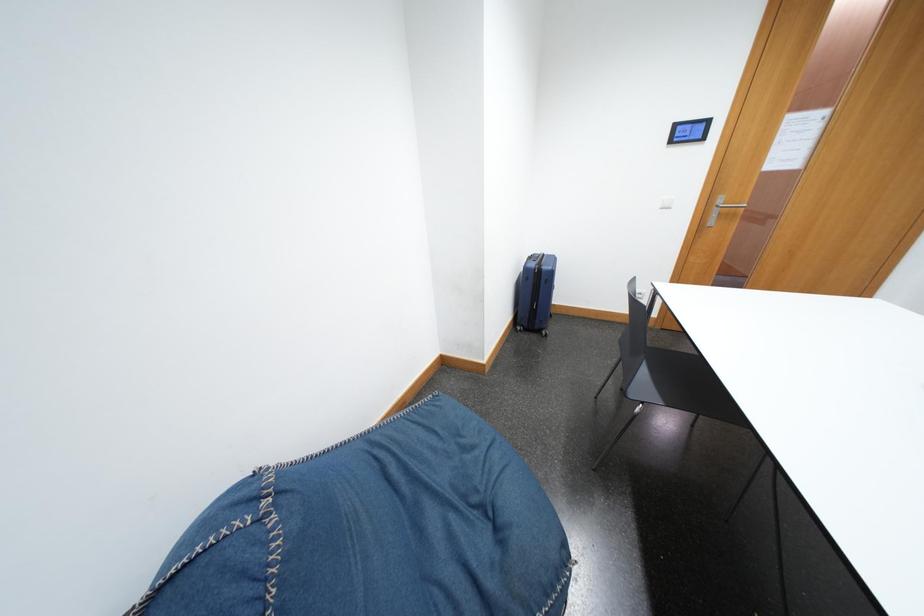
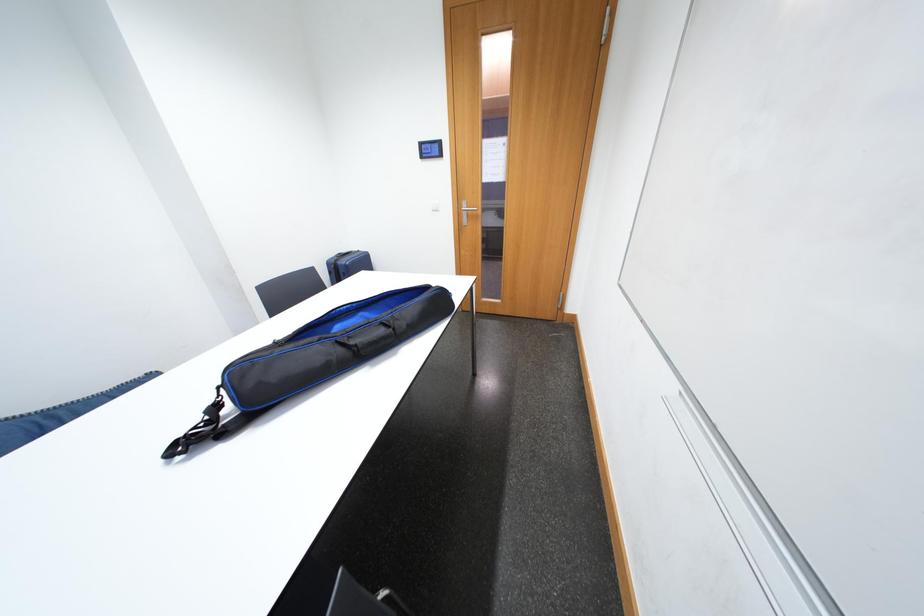
Question: Which direction would the cameraman need to move to produce the second image? Reply with the corresponding letter.

Choices:
 (A) Left
 (B) Right
 (C) Forward
 (D) Backward

Answer: (B)